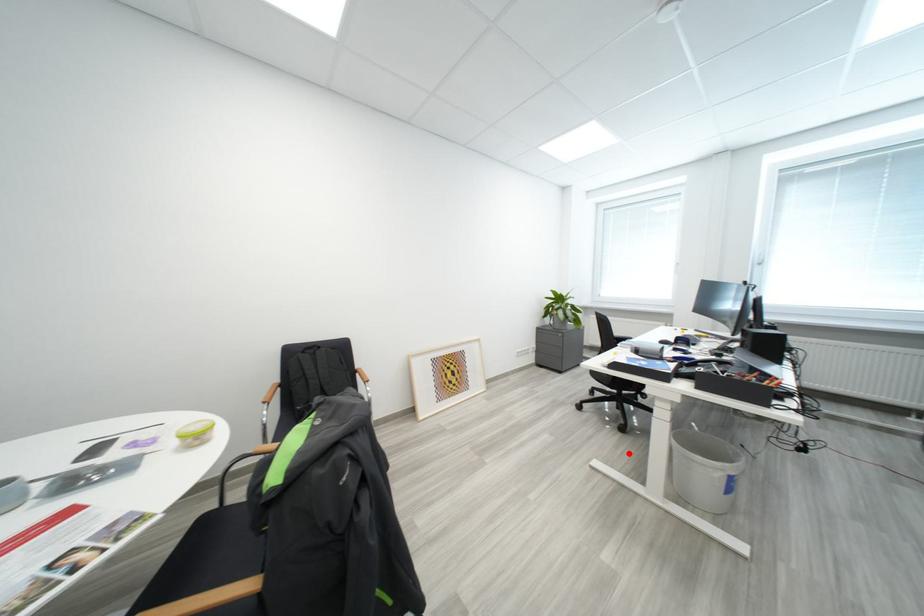
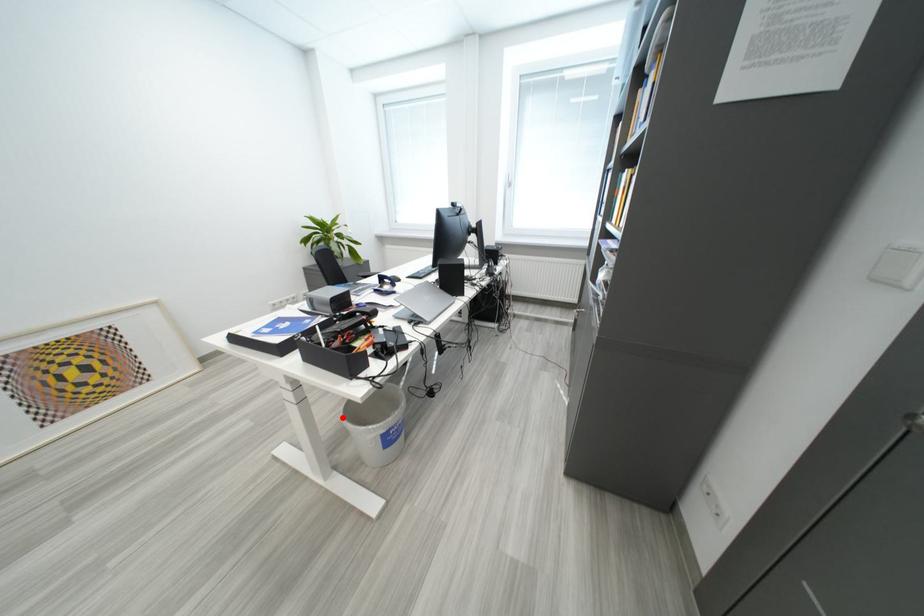
I am providing you with two images of the same scene from different viewpoints. A red point is marked on the first image and another point is marked on the second image. Is the red point in image1 aligned with the point shown in image2?

Yes